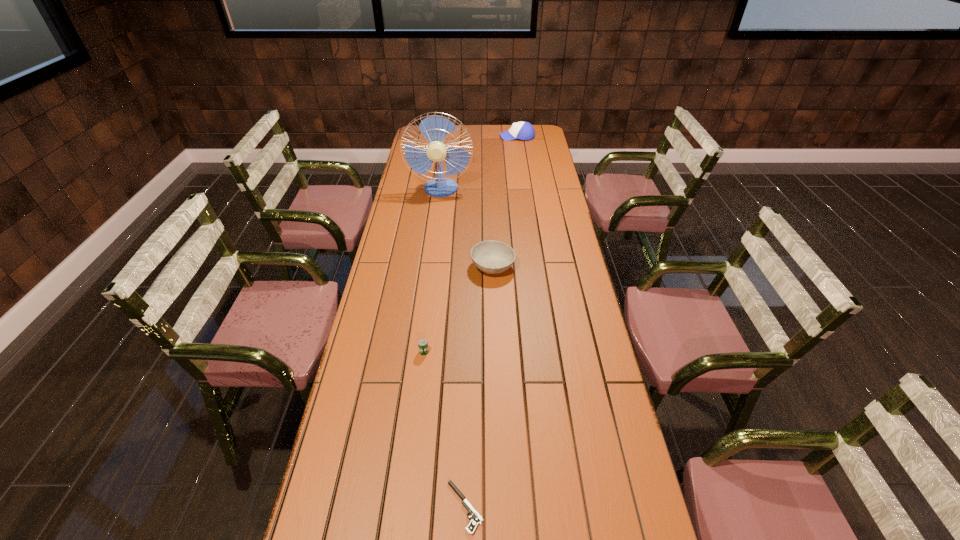
Locate an element on the screen. free spot that satisfies the following two spatial constraints: 1. at the front of the tallest object where the blades are visible; 2. on the left side of the fourth farthest object is located at coordinates (420, 352).